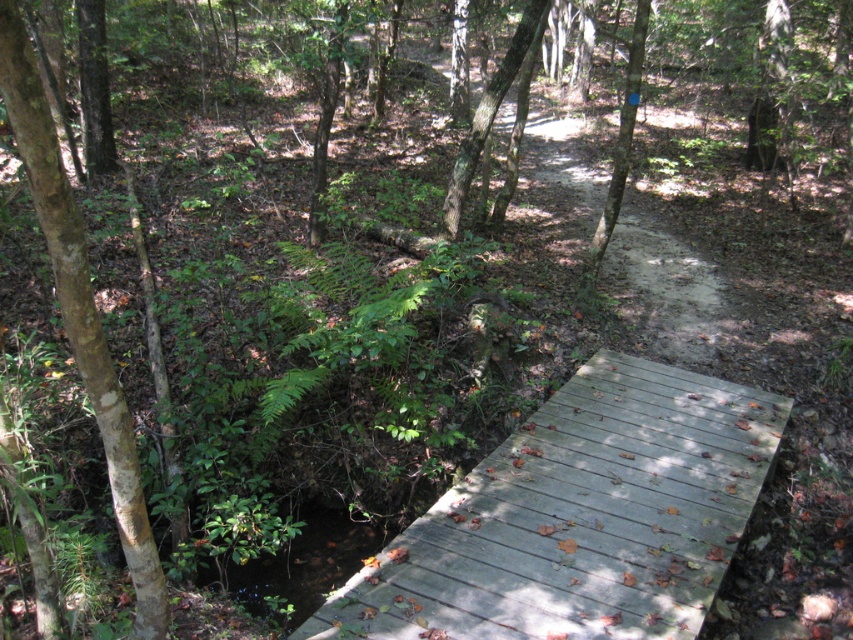
Can you confirm if smooth brown tree trunk at center is positioned to the left of smooth bark tree at upper center?

Yes, smooth brown tree trunk at center is to the left of smooth bark tree at upper center.

Can you confirm if smooth brown tree trunk at center is wider than smooth bark tree at upper center?

Indeed, smooth brown tree trunk at center has a greater width compared to smooth bark tree at upper center.

Identify the location of smooth brown tree trunk at center. (486, 116).

Is brown/scaly tree trunk at left in front of smooth brown tree trunk at center?

Yes, brown/scaly tree trunk at left is closer to the viewer.

Which of these two, brown/scaly tree trunk at left or smooth brown tree trunk at center, stands taller?

smooth brown tree trunk at center is taller.

Who is more forward, (x=28, y=112) or (x=476, y=129)?

Point (x=28, y=112)

This screenshot has width=853, height=640. Find the location of `brown/scaly tree trunk at left`. brown/scaly tree trunk at left is located at coordinates (80, 314).

Between point (439, 634) and point (593, 268), which one is positioned behind?

Positioned behind is point (593, 268).

Can you confirm if wooden bridge at center is smaller than smooth bark tree at upper center?

Actually, wooden bridge at center might be larger than smooth bark tree at upper center.

Which is behind, point (691, 381) or point (612, 218)?

Positioned behind is point (612, 218).

This screenshot has height=640, width=853. I want to click on wooden bridge at center, so click(579, 516).